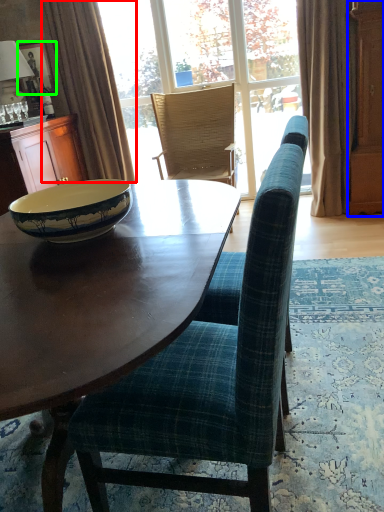
Question: Based on their relative distances, which object is nearer to curtain (highlighted by a red box)? Choose from screen door (highlighted by a blue box) and picture frame (highlighted by a green box).

Choices:
 (A) screen door
 (B) picture frame

Answer: (B)